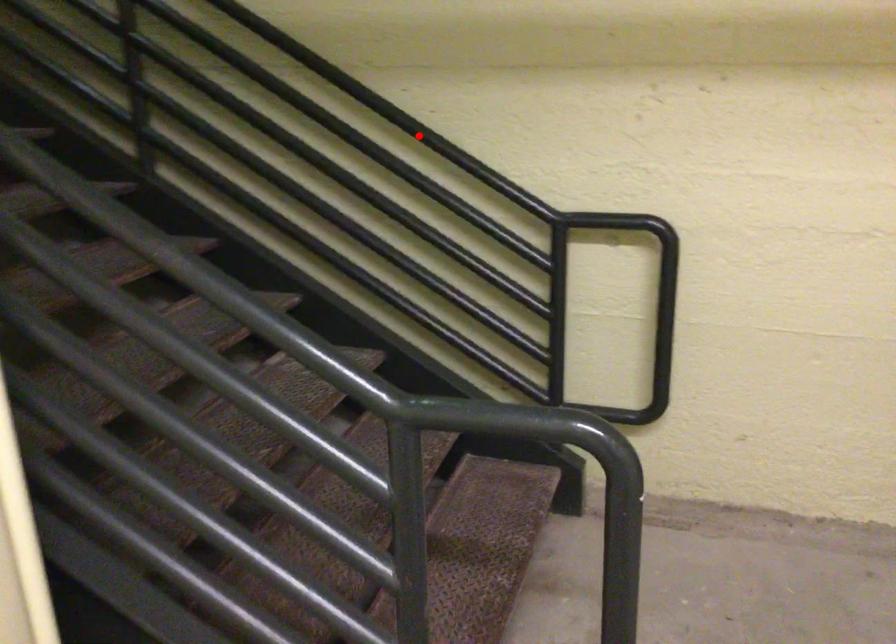
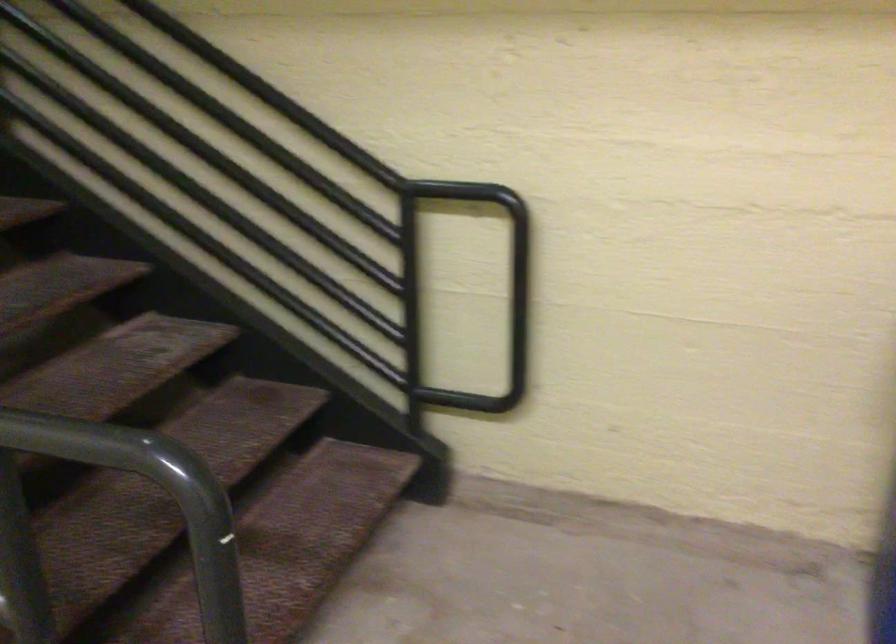
Question: A red point is marked in image1. In image2, is the corresponding 3D point closer to the camera or farther? Reply with the corresponding letter.

Choices:
 (A) The corresponding 3D point is closer.
 (B) The corresponding 3D point is farther.

Answer: (A)